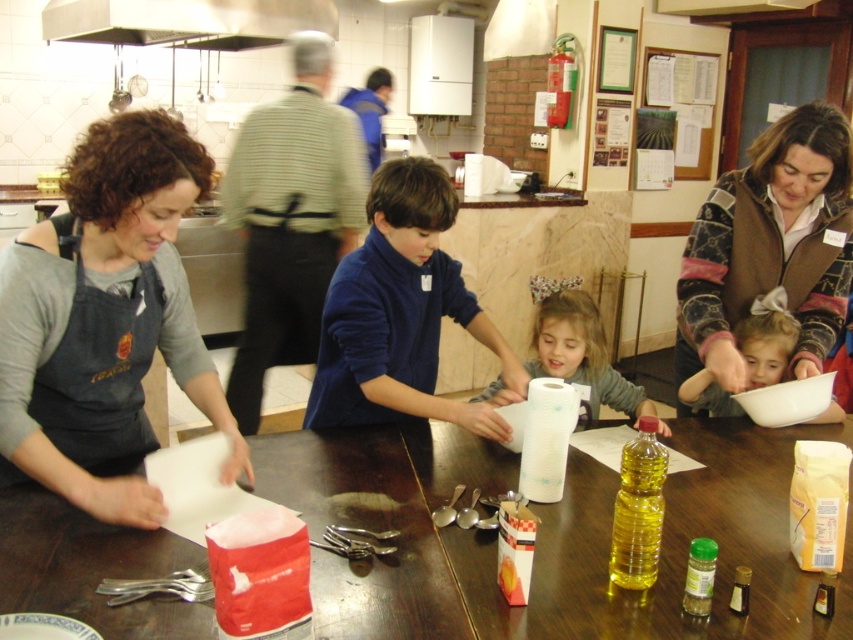
Question: Which point appears closest to the camera in this image?

Choices:
 (A) (753, 428)
 (B) (804, 180)
 (C) (102, 148)

Answer: (C)

Question: Among these points, which one is nearest to the camera?

Choices:
 (A) [120, 227]
 (B) [746, 280]
 (C) [544, 477]
 (D) [360, 372]

Answer: (A)

Question: Is the position of smooth white paper towel at center more distant than that of white paper bowl at center?

Choices:
 (A) yes
 (B) no

Answer: (B)

Question: Is knitted sweater at center further to camera compared to white paper bowl at center?

Choices:
 (A) no
 (B) yes

Answer: (A)

Question: Can you confirm if wooden table at center is wider than metallic at upper left?

Choices:
 (A) yes
 (B) no

Answer: (B)

Question: Which object is positioned farthest from the metallic at upper left?

Choices:
 (A) smooth white paper towel at center
 (B) white paper bowl at center
 (C) knitted sweater at center
 (D) white paper towel at center

Answer: (D)